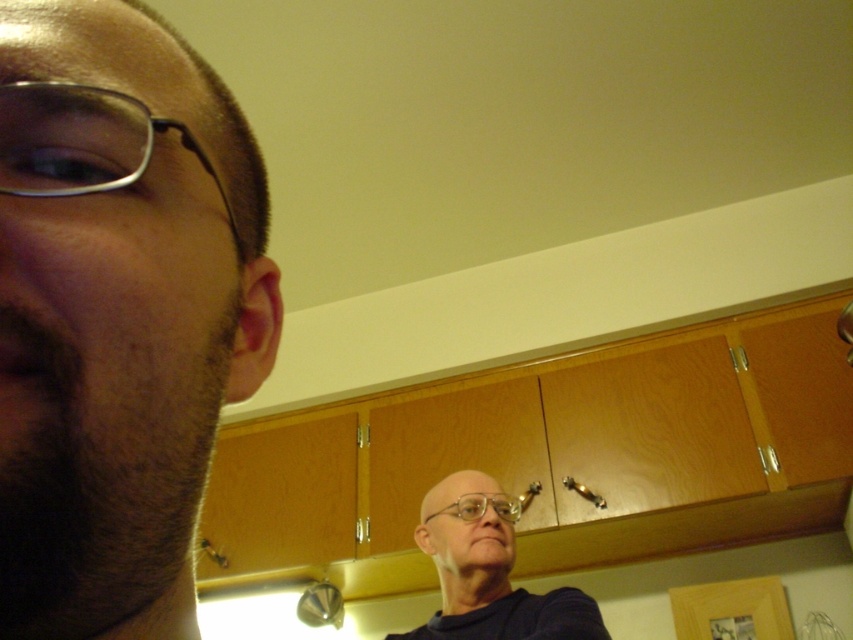
You are a delivery robot in a kitchen. You need to place a package on the counter between the bald head at upper center and the metallic frame glasses at left. How far apart are these two objects?

The bald head at upper center is 3.84 feet away from the metallic frame glasses at left, so the package can be placed between them at that distance.

You are a photographer adjusting the lighting in a kitchen scene. You notice the bald head at upper center and the metallic frame glasses at left. Which object is positioned lower in the frame?

The bald head at upper center is positioned lower than the metallic frame glasses at left.